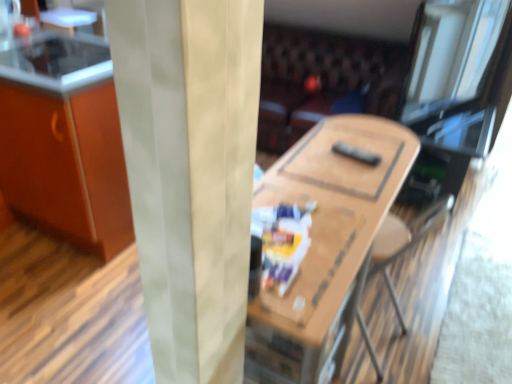
The height and width of the screenshot is (384, 512). I want to click on vacant area to the right of wooden table at center, so click(449, 305).